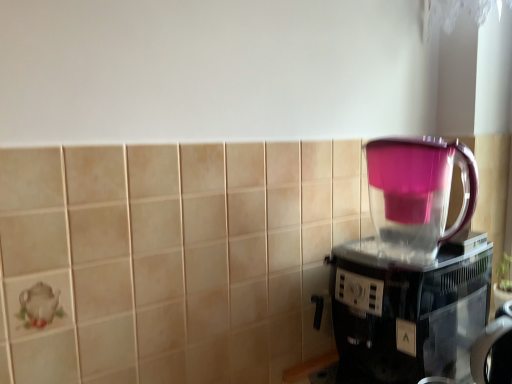
Measure the distance between pink translucent pitcher at right and camera.

pink translucent pitcher at right is 31.43 inches away from camera.

Image resolution: width=512 pixels, height=384 pixels. What do you see at coordinates (417, 193) in the screenshot? I see `pink translucent pitcher at right` at bounding box center [417, 193].

Locate an element on the screen. The image size is (512, 384). pink translucent pitcher at right is located at coordinates (417, 193).

What do you see at coordinates (411, 270) in the screenshot? The width and height of the screenshot is (512, 384). I see `transparent plastic coffee maker at right` at bounding box center [411, 270].

This screenshot has width=512, height=384. I want to click on transparent plastic coffee maker at right, so (x=411, y=270).

The width and height of the screenshot is (512, 384). Identify the location of pink translucent pitcher at right. (417, 193).

Which object is positioned more to the left, pink translucent pitcher at right or transparent plastic coffee maker at right?

pink translucent pitcher at right is more to the left.

Considering their positions, is pink translucent pitcher at right located in front of or behind transparent plastic coffee maker at right?

Visually, pink translucent pitcher at right is located behind transparent plastic coffee maker at right.

Is point (386, 189) closer or farther from the camera than point (420, 371)?

Point (386, 189) is farther from the camera than point (420, 371).

From the image's perspective, which one is positioned higher, pink translucent pitcher at right or transparent plastic coffee maker at right?

pink translucent pitcher at right appears higher in the image.

From a real-world perspective, is pink translucent pitcher at right physically located above or below transparent plastic coffee maker at right?

pink translucent pitcher at right is situated higher than transparent plastic coffee maker at right in the real world.

Which of these two, pink translucent pitcher at right or transparent plastic coffee maker at right, is wider?

Wider between the two is transparent plastic coffee maker at right.

Considering the sizes of objects pink translucent pitcher at right and transparent plastic coffee maker at right in the image provided, who is shorter, pink translucent pitcher at right or transparent plastic coffee maker at right?

pink translucent pitcher at right.

Between pink translucent pitcher at right and transparent plastic coffee maker at right, which one has larger size?

With larger size is transparent plastic coffee maker at right.

Do you think pink translucent pitcher at right is within transparent plastic coffee maker at right, or outside of it?

The correct answer is: outside.

Based on the photo, is pink translucent pitcher at right not close to transparent plastic coffee maker at right?

No, there isn't a large distance between pink translucent pitcher at right and transparent plastic coffee maker at right.

Is pink translucent pitcher at right facing towards transparent plastic coffee maker at right?

No, pink translucent pitcher at right is not turned towards transparent plastic coffee maker at right.

Can you tell me how much pink translucent pitcher at right and transparent plastic coffee maker at right differ in facing direction?

The angular difference between pink translucent pitcher at right and transparent plastic coffee maker at right is 0.000556 degrees.

Measure the distance between pink translucent pitcher at right and transparent plastic coffee maker at right.

pink translucent pitcher at right is 2.33 inches from transparent plastic coffee maker at right.

Identify the location of coffee maker lying below the pink translucent pitcher at right (from the image's perspective). (411, 270).

Between transparent plastic coffee maker at right and pink translucent pitcher at right, which one appears on the left side from the viewer's perspective?

Positioned to the left is pink translucent pitcher at right.

Considering the positions of objects transparent plastic coffee maker at right and pink translucent pitcher at right in the image provided, who is behind, transparent plastic coffee maker at right or pink translucent pitcher at right?

pink translucent pitcher at right is further away from the camera.

Is point (419, 309) more distant than point (398, 164)?

No, it is not.

From the image's perspective, which one is positioned lower, transparent plastic coffee maker at right or pink translucent pitcher at right?

From the image's view, transparent plastic coffee maker at right is below.

From a real-world perspective, is transparent plastic coffee maker at right beneath pink translucent pitcher at right?

Yes.

Which object is thinner, transparent plastic coffee maker at right or pink translucent pitcher at right?

Thinner between the two is pink translucent pitcher at right.

Can you confirm if transparent plastic coffee maker at right is shorter than pink translucent pitcher at right?

Incorrect, the height of transparent plastic coffee maker at right does not fall short of that of pink translucent pitcher at right.

Between transparent plastic coffee maker at right and pink translucent pitcher at right, which one has larger size?

transparent plastic coffee maker at right.

Choose the correct answer: Is transparent plastic coffee maker at right inside pink translucent pitcher at right or outside it?

transparent plastic coffee maker at right is spatially situated outside pink translucent pitcher at right.

Is transparent plastic coffee maker at right not near pink translucent pitcher at right?

Actually, transparent plastic coffee maker at right and pink translucent pitcher at right are a little close together.

Is transparent plastic coffee maker at right looking in the opposite direction of pink translucent pitcher at right?

No, transparent plastic coffee maker at right is not facing away from pink translucent pitcher at right.

You are a GUI agent. You are given a task and a screenshot of the screen. Output one action in this format:
    pyautogui.click(x=<x>, y=<y>)
    Task: Click on the coffee maker in front of the pink translucent pitcher at right
    
    Given the screenshot: What is the action you would take?
    pyautogui.click(x=411, y=270)

In order to click on coffee maker in front of the pink translucent pitcher at right in this screenshot , I will do `click(411, 270)`.

In the image, there is a pink translucent pitcher at right. At what (x,y) coordinates should I click in order to perform the action: click on coffee maker below it (from a real-world perspective). Please return your answer as a coordinate pair (x, y). This screenshot has width=512, height=384. Looking at the image, I should click on (411, 270).